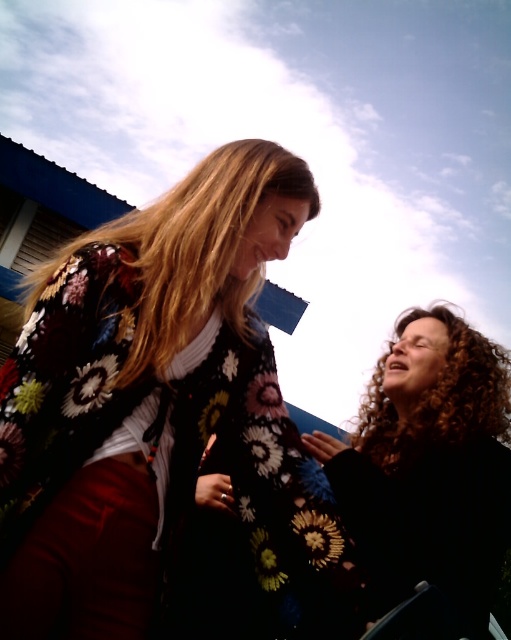
Can you confirm if floral-patterned sweater at center is smaller than black curly hair at right?

Indeed, floral-patterned sweater at center has a smaller size compared to black curly hair at right.

Who is lower down, floral-patterned sweater at center or black curly hair at right?

black curly hair at right

Image resolution: width=511 pixels, height=640 pixels. In order to click on floral-patterned sweater at center in this screenshot , I will do `click(166, 428)`.

Who is lower down, floral-patterned sweater at center or blonde silky hair at upper center?

floral-patterned sweater at center

Which of these two, floral-patterned sweater at center or blonde silky hair at upper center, stands taller?

Standing taller between the two is floral-patterned sweater at center.

Describe the element at coordinates (166, 428) in the screenshot. I see `floral-patterned sweater at center` at that location.

This screenshot has width=511, height=640. In order to click on floral-patterned sweater at center in this screenshot , I will do `click(166, 428)`.

Is blonde silky hair at upper center further to the viewer compared to curly brown hair at lower right?

That is False.

Is point (165, 216) farther from viewer compared to point (461, 385)?

No, (165, 216) is in front of (461, 385).

Where is `blonde silky hair at upper center`? The height and width of the screenshot is (640, 511). blonde silky hair at upper center is located at coordinates (193, 244).